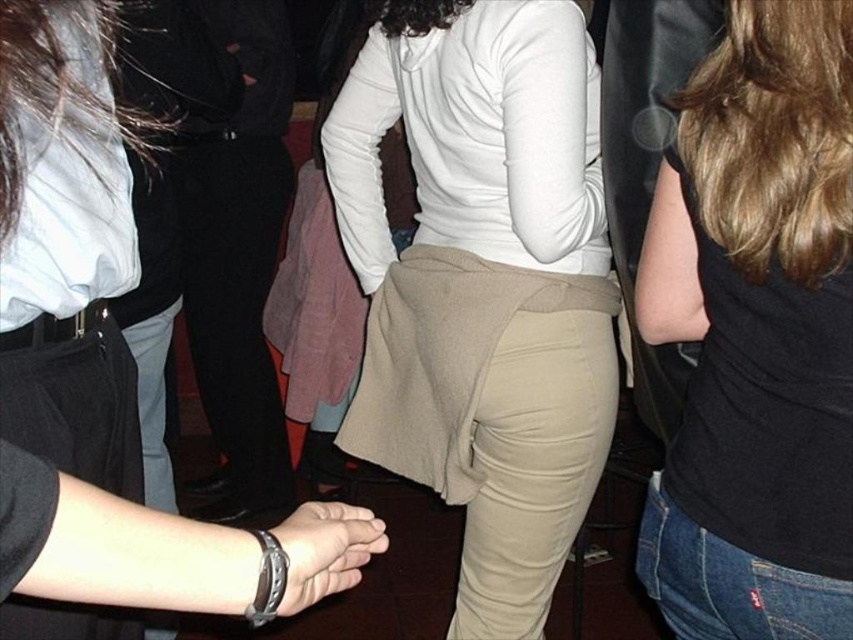
Question: Which of the following is the farthest from the observer?

Choices:
 (A) (778, 140)
 (B) (302, 592)
 (C) (467, 209)

Answer: (C)

Question: Does khaki fabric pants at center have a smaller size compared to leather wristwatch at center?

Choices:
 (A) no
 (B) yes

Answer: (A)

Question: Does khaki fabric pants at center have a larger size compared to black matte tank top at upper right?

Choices:
 (A) yes
 (B) no

Answer: (A)

Question: Is black matte tank top at upper right smaller than leather wristwatch at center?

Choices:
 (A) yes
 (B) no

Answer: (B)

Question: Which point appears farthest from the camera in this image?

Choices:
 (A) (321, 556)
 (B) (593, 435)

Answer: (B)

Question: Which of these objects is positioned closest to the black matte tank top at upper right?

Choices:
 (A) khaki fabric pants at center
 (B) leather wristwatch at center

Answer: (A)